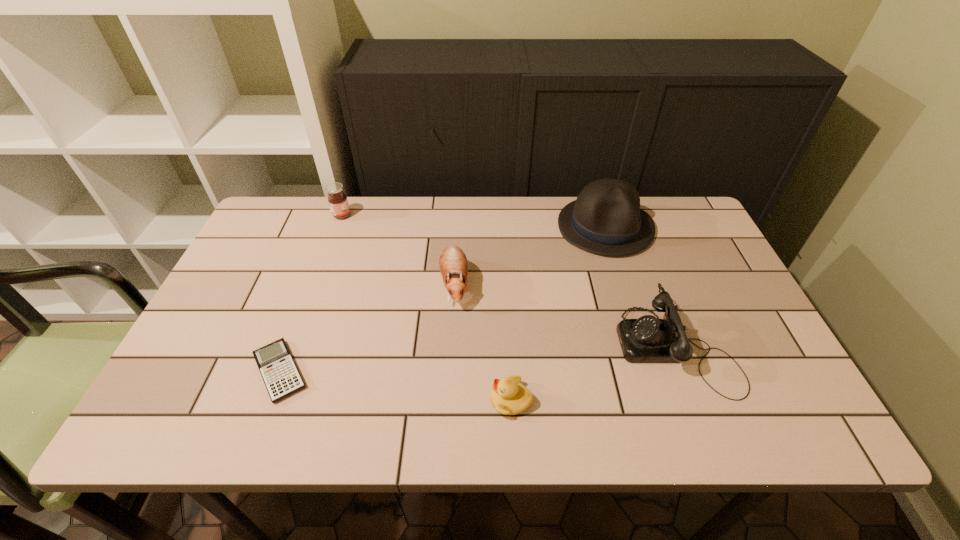
The image size is (960, 540). Identify the location of blank space located 0.370m on the front-facing side of the telephone. (462, 347).

This screenshot has width=960, height=540. Identify the location of vacant point located on the front-facing side of the telephone. (556, 347).

I want to click on vacant space positioned at the face of the third object from left to right, so click(450, 353).

I want to click on free space located 0.400m at the face of the duckling, so click(x=301, y=400).

Find the location of a particular element. This screenshot has width=960, height=540. vacant region located at the face of the duckling is located at coordinates (320, 400).

The height and width of the screenshot is (540, 960). I want to click on vacant region located at the face of the duckling, so click(x=348, y=400).

At what (x,y) coordinates should I click in order to perform the action: click on vacant region located 0.090m on the left of the shortest object. Please return your answer as a coordinate pair (x, y). Looking at the image, I should click on (207, 371).

Find the location of a particular element. bowler hat located at the far edge is located at coordinates (606, 219).

The height and width of the screenshot is (540, 960). Find the location of `jam situated at the far edge`. jam situated at the far edge is located at coordinates (337, 199).

Where is `telephone located in the near edge section of the desktop`? The height and width of the screenshot is (540, 960). telephone located in the near edge section of the desktop is located at coordinates (648, 339).